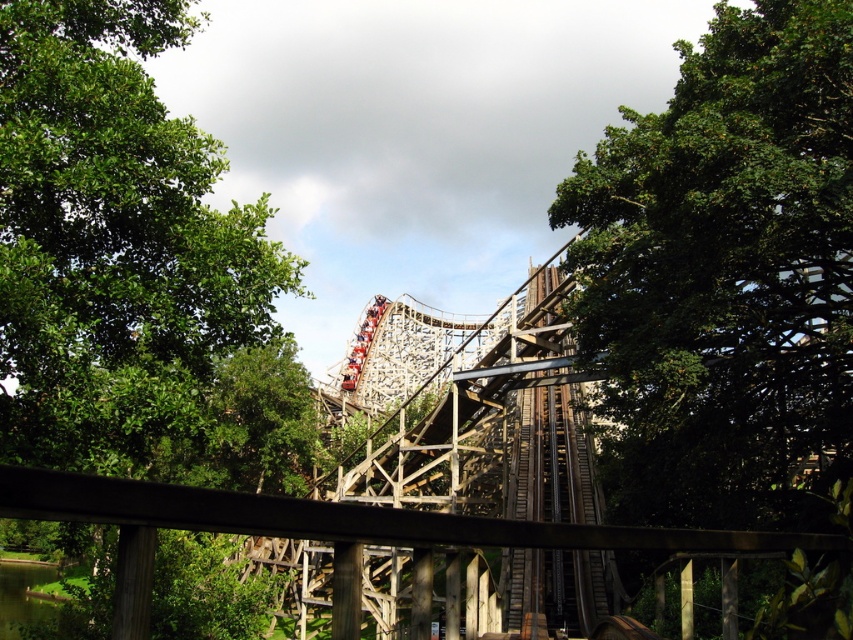
Is point (717, 157) more distant than point (100, 216)?

No, (717, 157) is closer to viewer.

Who is more forward, (694, 237) or (7, 104)?

Point (7, 104)

Does point (831, 404) come in front of point (149, 125)?

No, it is not.

Find the location of a particular element. green leafy tree at center is located at coordinates (726, 275).